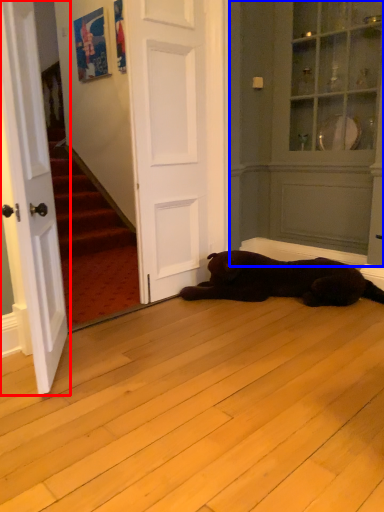
Question: Among these objects, which one is farthest to the camera, door (highlighted by a red box) or armoire (highlighted by a blue box)?

Choices:
 (A) door
 (B) armoire

Answer: (B)